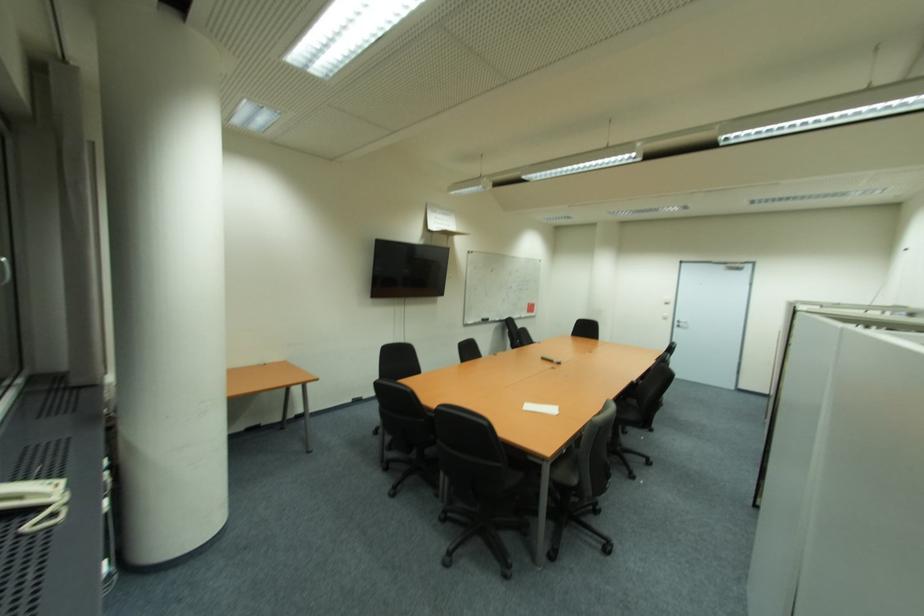
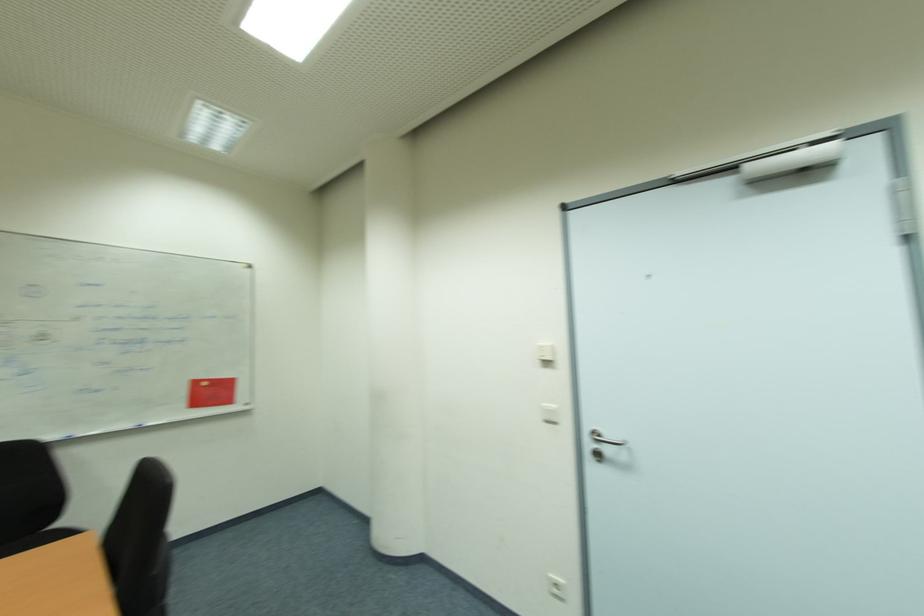
In the second image, find the point that corresponds to pixel 672 315 in the first image.

(556, 407)